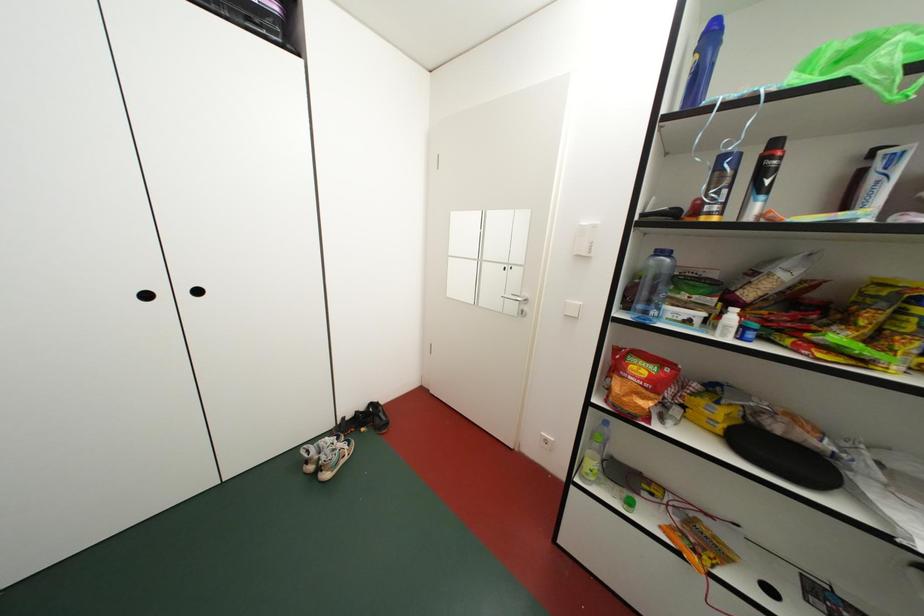
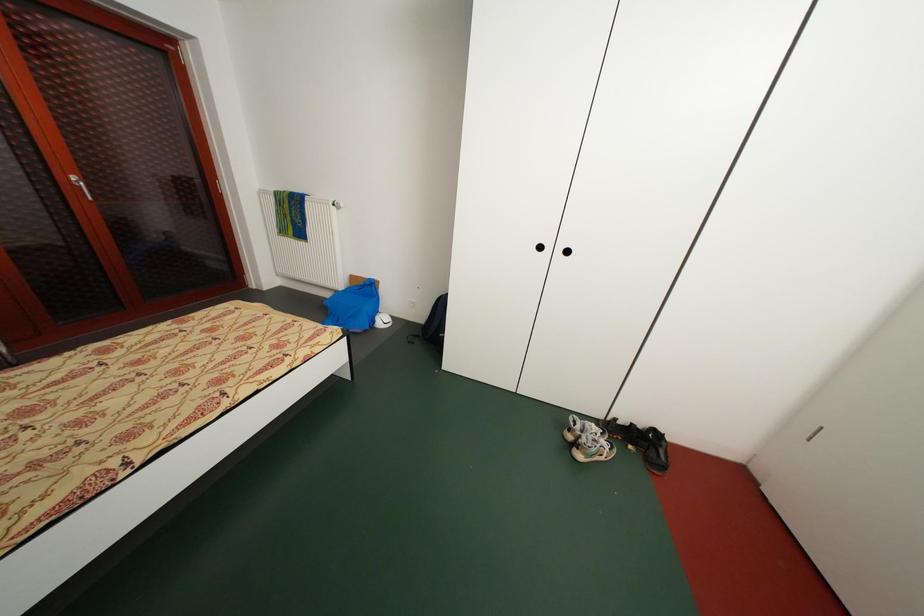
Question: The images are taken continuously from a first-person perspective. In which direction is your viewpoint rotating?

Choices:
 (A) Left
 (B) Right
 (C) Up
 (D) Down

Answer: (A)